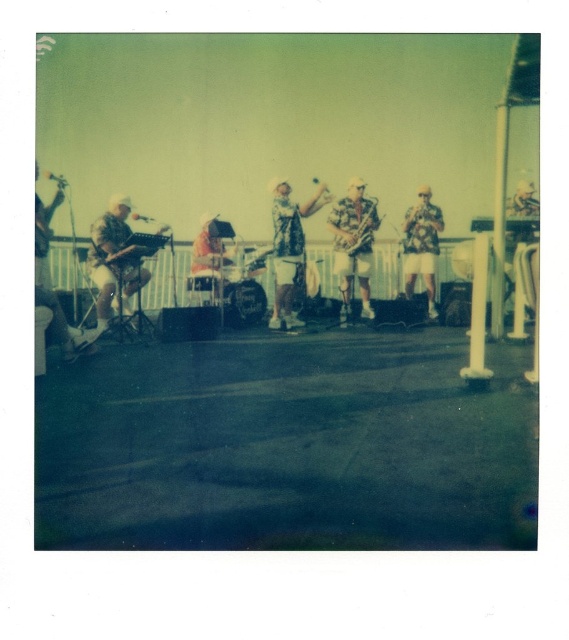
Between matte brown guitar at left and wooden saxophone at center, which one is positioned lower?

matte brown guitar at left

Is point (101, 276) less distant than point (343, 300)?

Yes, point (101, 276) is closer to viewer.

The height and width of the screenshot is (640, 569). In order to click on matte brown guitar at left in this screenshot , I will do `click(114, 260)`.

From the picture: Does wooden saxophone at center have a lesser width compared to gold metallic saxophone at center?

No, wooden saxophone at center is not thinner than gold metallic saxophone at center.

Can you confirm if wooden saxophone at center is taller than gold metallic saxophone at center?

Indeed, wooden saxophone at center has a greater height compared to gold metallic saxophone at center.

Identify the location of wooden saxophone at center. The height and width of the screenshot is (640, 569). (353, 244).

Who is positioned more to the right, wooden saxophone at center or floral shirt at center?

floral shirt at center is more to the right.

Does wooden saxophone at center have a larger size compared to floral shirt at center?

Yes, wooden saxophone at center is bigger than floral shirt at center.

At what (x,y) coordinates should I click in order to perform the action: click on wooden saxophone at center. Please return your answer as a coordinate pair (x, y). Looking at the image, I should click on (353, 244).

The height and width of the screenshot is (640, 569). Identify the location of wooden saxophone at center. (353, 244).